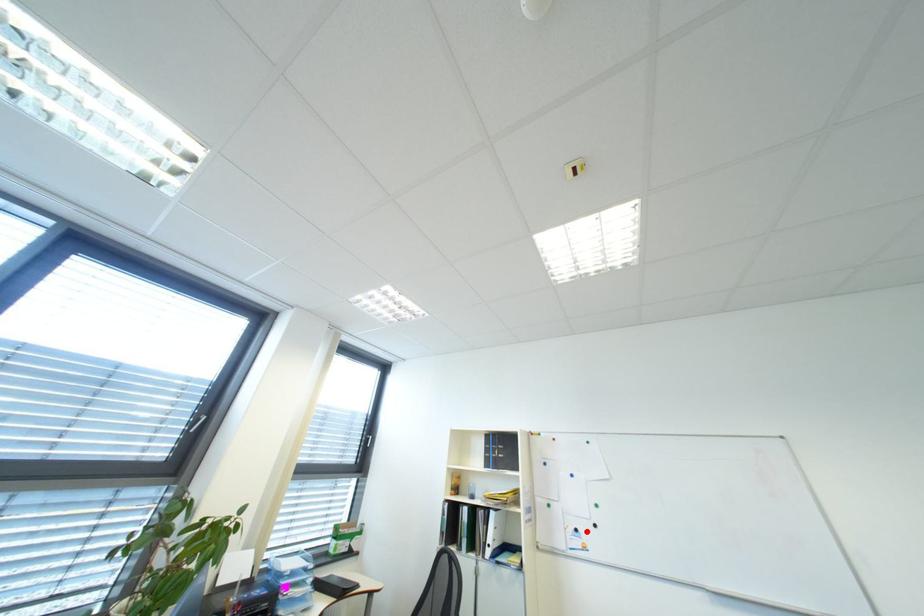
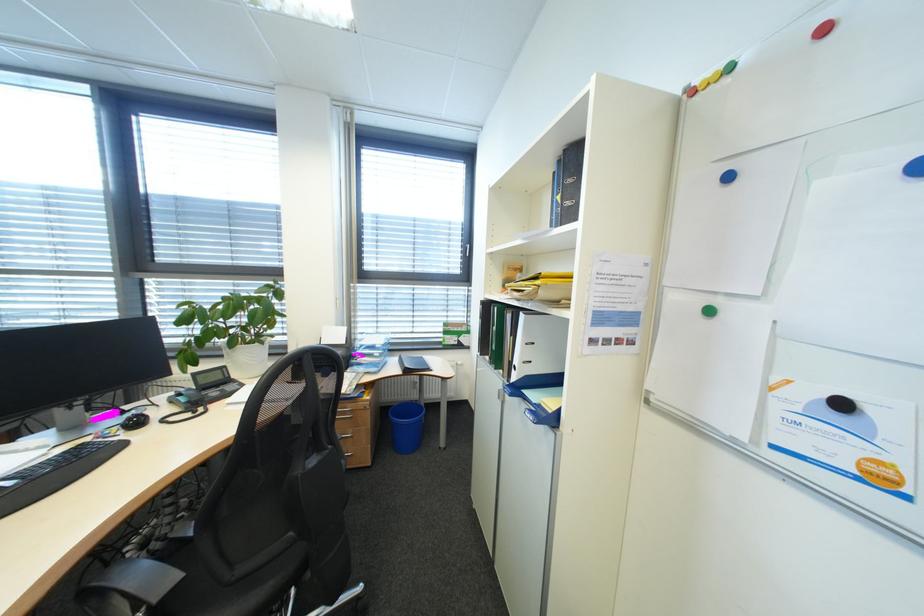
Question: I am providing you with two images of the same scene from different viewpoints. A red point is marked on the first image. At the location where the point appears in image 1, is it still visible in image 2?

Choices:
 (A) Yes
 (B) No

Answer: (A)